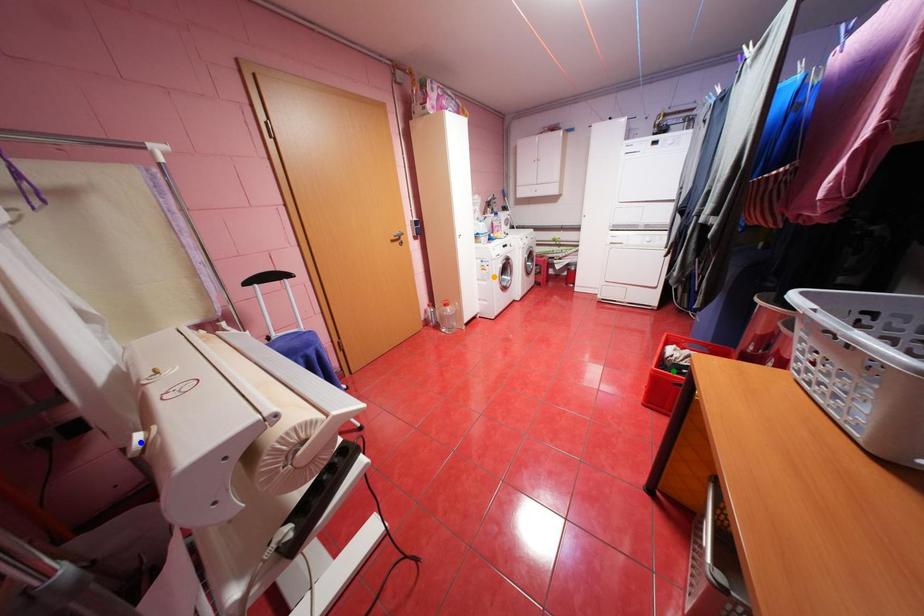
Order these from nearest to farthest:
blue point, orange point, green point

blue point → green point → orange point